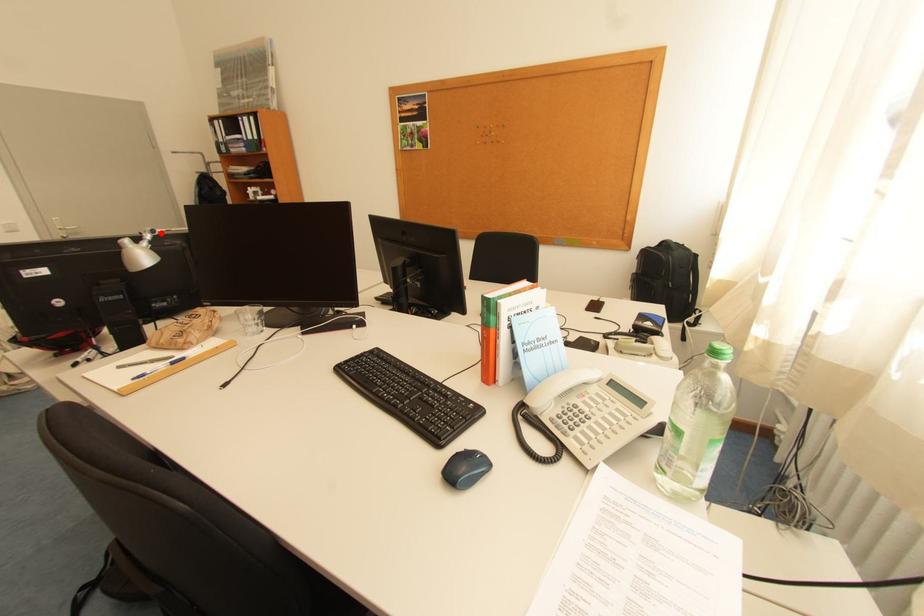
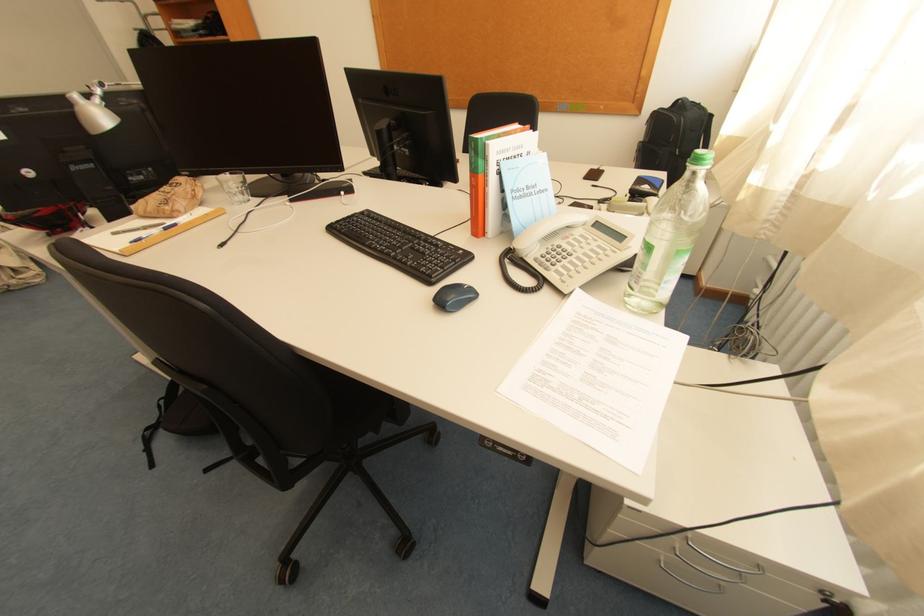
Locate, in the second image, the point that corresponds to the highlighted location in the first image.

(110, 86)